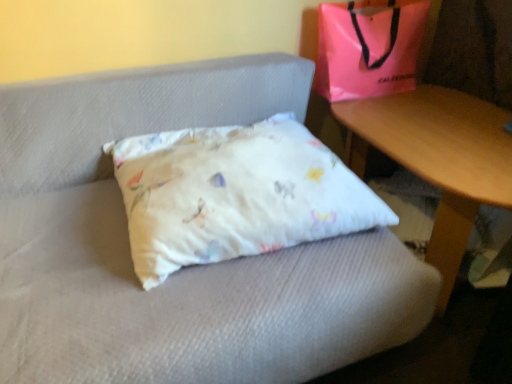
The height and width of the screenshot is (384, 512). What do you see at coordinates (369, 47) in the screenshot?
I see `pink plastic bag at upper right` at bounding box center [369, 47].

Find the location of `white cotton pillow at center`. white cotton pillow at center is located at coordinates (234, 194).

In order to face wooden table at lower right, should I rotate leftwards or rightwards?

Turn right by 24.492 degrees to look at wooden table at lower right.

Where is `pink plastic bag at upper right`? This screenshot has height=384, width=512. pink plastic bag at upper right is located at coordinates (369, 47).

Is pink plastic bag at upper right outside of white cotton pillow at center?

Yes.

In the scene shown: Does pink plastic bag at upper right have a lesser width compared to white cotton pillow at center?

Correct, the width of pink plastic bag at upper right is less than that of white cotton pillow at center.

Which object is positioned more to the right, pink plastic bag at upper right or white cotton pillow at center?

Positioned to the right is pink plastic bag at upper right.

From the image's perspective, which is above, wooden table at lower right or pink plastic bag at upper right?

pink plastic bag at upper right appears higher in the image.

Which is in front, wooden table at lower right or pink plastic bag at upper right?

wooden table at lower right is closer to the camera.

Consider the image. Between wooden table at lower right and pink plastic bag at upper right, which one appears on the left side from the viewer's perspective?

From the viewer's perspective, pink plastic bag at upper right appears more on the left side.

In the scene shown: Is wooden table at lower right facing towards pink plastic bag at upper right?

No, wooden table at lower right is not oriented towards pink plastic bag at upper right.

From a real-world perspective, who is located higher, wooden table at lower right or white cotton pillow at center?

From a 3D spatial view, white cotton pillow at center is above.

Considering the sizes of objects wooden table at lower right and white cotton pillow at center in the image provided, who is shorter, wooden table at lower right or white cotton pillow at center?

With less height is white cotton pillow at center.

Considering the sizes of objects wooden table at lower right and white cotton pillow at center in the image provided, who is wider, wooden table at lower right or white cotton pillow at center?

white cotton pillow at center.

Which object is positioned more to the left, white cotton pillow at center or pink plastic bag at upper right?

Positioned to the left is white cotton pillow at center.

Is white cotton pillow at center smaller than pink plastic bag at upper right?

No, white cotton pillow at center is not smaller than pink plastic bag at upper right.

This screenshot has width=512, height=384. In order to click on pouch lying behind the white cotton pillow at center in this screenshot , I will do 369,47.

How much distance is there between pink plastic bag at upper right and wooden table at lower right?

pink plastic bag at upper right is 11.07 inches from wooden table at lower right.

Does pink plastic bag at upper right have a smaller size compared to wooden table at lower right?

Yes.

From the picture: From the image's perspective, does pink plastic bag at upper right appear lower than wooden table at lower right?

No.

How many degrees apart are the facing directions of white cotton pillow at center and wooden table at lower right?

There is a 87.3-degree angle between the facing directions of white cotton pillow at center and wooden table at lower right.

Is white cotton pillow at center directly adjacent to wooden table at lower right?

No.

Where is `pillow above the wooden table at lower right (from a real-world perspective)`? This screenshot has width=512, height=384. pillow above the wooden table at lower right (from a real-world perspective) is located at coordinates (234, 194).

The height and width of the screenshot is (384, 512). I want to click on pillow below the pink plastic bag at upper right (from the image's perspective), so click(234, 194).

You are a GUI agent. You are given a task and a screenshot of the screen. Output one action in this format:
    pyautogui.click(x=<x>, y=<y>)
    Task: Click on the table lying on the right of pink plastic bag at upper right
    This screenshot has height=384, width=512.
    Given the screenshot: What is the action you would take?
    pyautogui.click(x=438, y=158)

In the scene shown: Estimate the real-world distances between objects in this image. Which object is further from wooden table at lower right, white cotton pillow at center or pink plastic bag at upper right?

Based on the image, white cotton pillow at center appears to be further to wooden table at lower right.

Which object lies nearer to the anchor point white cotton pillow at center, pink plastic bag at upper right or wooden table at lower right?

Among the two, wooden table at lower right is located nearer to white cotton pillow at center.

Estimate the real-world distances between objects in this image. Which object is further from pink plastic bag at upper right, wooden table at lower right or white cotton pillow at center?

Among the two, white cotton pillow at center is located further to pink plastic bag at upper right.

Which object lies nearer to the anchor point pink plastic bag at upper right, white cotton pillow at center or wooden table at lower right?

wooden table at lower right is closer to pink plastic bag at upper right.

When comparing their distances from wooden table at lower right, does pink plastic bag at upper right or white cotton pillow at center seem further?

Among the two, white cotton pillow at center is located further to wooden table at lower right.

Based on their spatial positions, is wooden table at lower right or pink plastic bag at upper right further from white cotton pillow at center?

Among the two, pink plastic bag at upper right is located further to white cotton pillow at center.

I want to click on pouch between white cotton pillow at center and wooden table at lower right, so click(x=369, y=47).